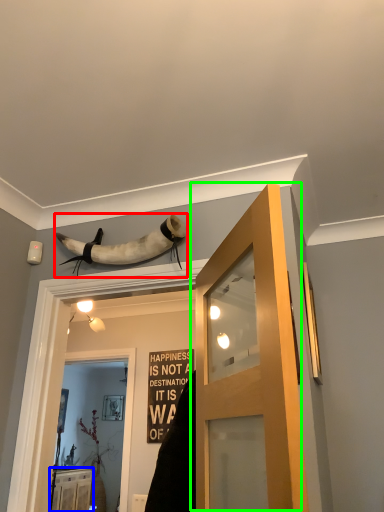
Question: Based on their relative distances, which object is nearer to animal (highlighted by a red box)? Choose from cabinetry (highlighted by a blue box) and door (highlighted by a green box).

Choices:
 (A) cabinetry
 (B) door

Answer: (B)